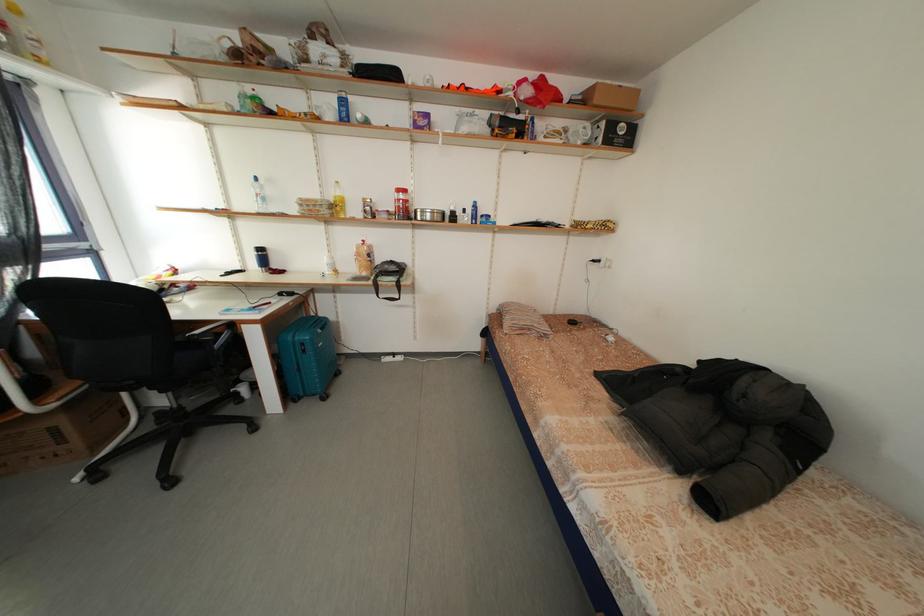
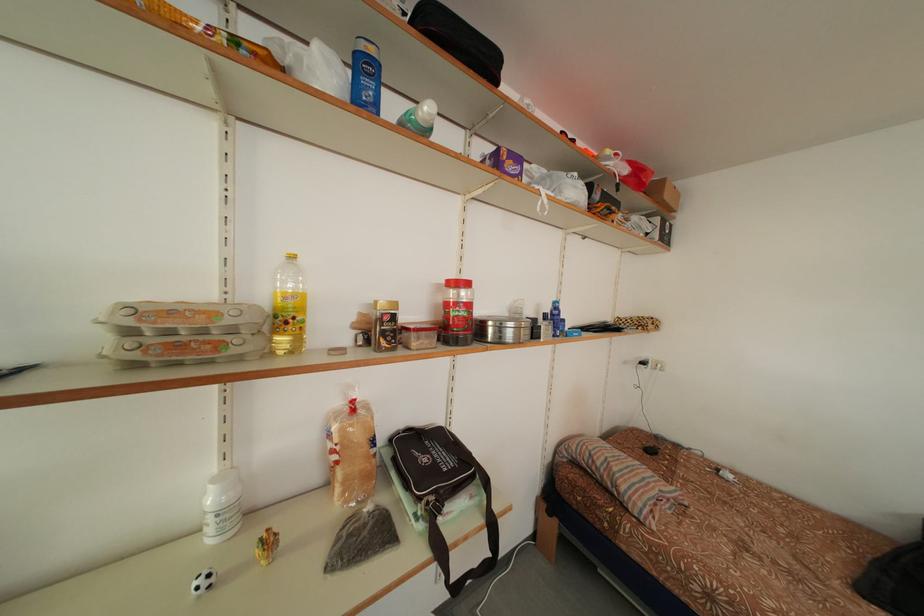
Where in the second image is the point corresponding to (x=344, y=207) from the first image?

(292, 314)